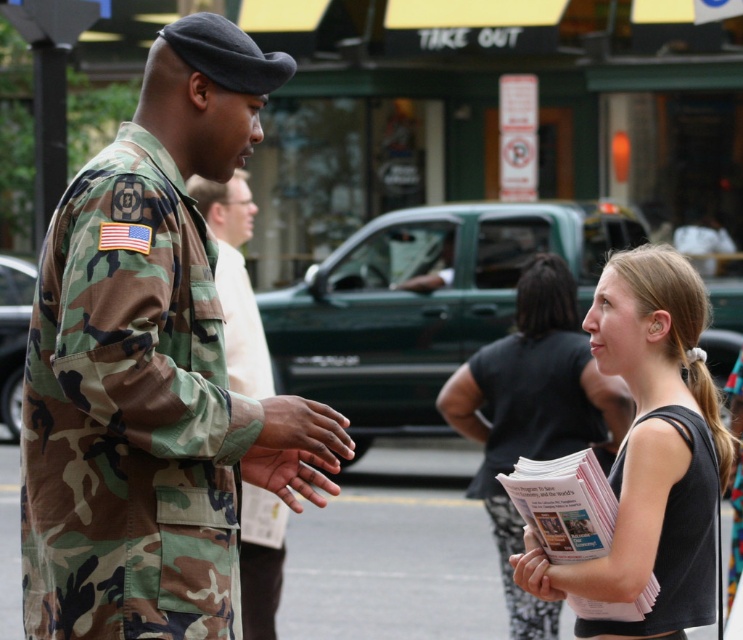
Measure the distance between point (x=545, y=300) and camera.

They are 8.14 meters apart.

Who is more forward, (470, 410) or (293, 428)?

Point (293, 428) is in front.

The width and height of the screenshot is (743, 640). What are the coordinates of `black tank top at center` in the screenshot? It's located at (x=533, y=412).

You are a GUI agent. You are given a task and a screenshot of the screen. Output one action in this format:
    pyautogui.click(x=<x>, y=<y>)
    Task: Click on the black tank top at center
    The height and width of the screenshot is (640, 743).
    Given the screenshot: What is the action you would take?
    pyautogui.click(x=533, y=412)

Does black matte uniform at lower right have a greater height compared to smooth white paper at lower center?

Correct, black matte uniform at lower right is much taller as smooth white paper at lower center.

The width and height of the screenshot is (743, 640). Identify the location of black matte uniform at lower right. (678, 540).

Which is above, camouflage uniform at left or camo uniform at center?

camo uniform at center

Can you confirm if camouflage uniform at left is positioned to the right of camo uniform at center?

Yes, camouflage uniform at left is to the right of camo uniform at center.

The image size is (743, 640). What do you see at coordinates (140, 364) in the screenshot?
I see `camouflage uniform at left` at bounding box center [140, 364].

Identify the location of camouflage uniform at left. (140, 364).